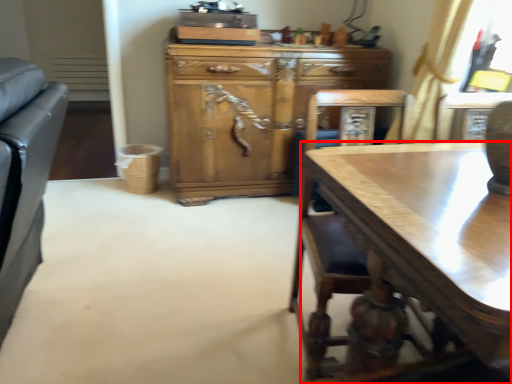
Question: Considering the relative positions of desk (annotated by the red box) and cabinetry in the image provided, where is desk (annotated by the red box) located with respect to the staircase?

Choices:
 (A) left
 (B) right

Answer: (B)